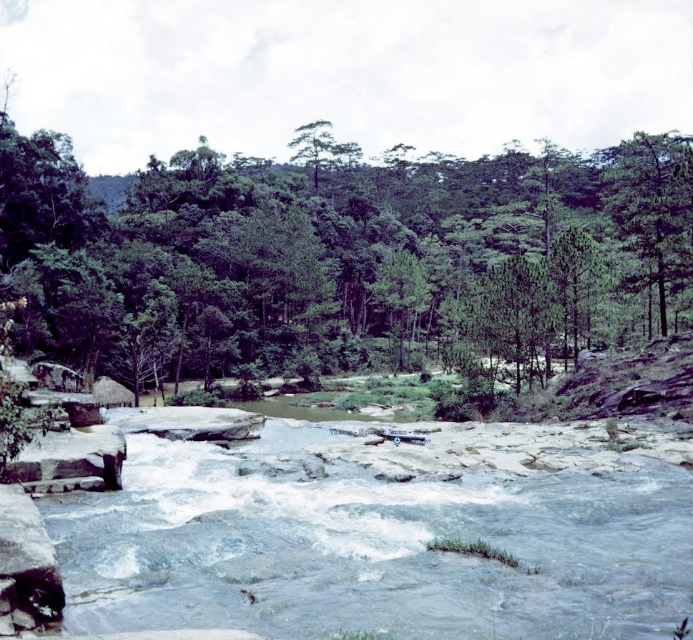
Question: Can you confirm if green leafy forest at center is wider than green matte tree at center?

Choices:
 (A) yes
 (B) no

Answer: (A)

Question: Can you confirm if clear water at center is thinner than green matte tree at center?

Choices:
 (A) no
 (B) yes

Answer: (A)

Question: Which object is the farthest from the green matte tree at center?

Choices:
 (A) green matte tree at upper center
 (B) green matte tree at upper right
 (C) green leafy forest at center
 (D) clear water at center

Answer: (D)

Question: Which object is farther from the camera taking this photo?

Choices:
 (A) green matte tree at upper right
 (B) green matte tree at upper center
 (C) green leafy forest at center
 (D) clear water at center

Answer: (B)

Question: Based on their relative distances, which object is farther from the green leafy forest at center?

Choices:
 (A) clear water at center
 (B) green matte tree at upper right
 (C) green matte tree at center

Answer: (A)

Question: Does green leafy forest at center have a smaller size compared to green matte tree at center?

Choices:
 (A) no
 (B) yes

Answer: (A)